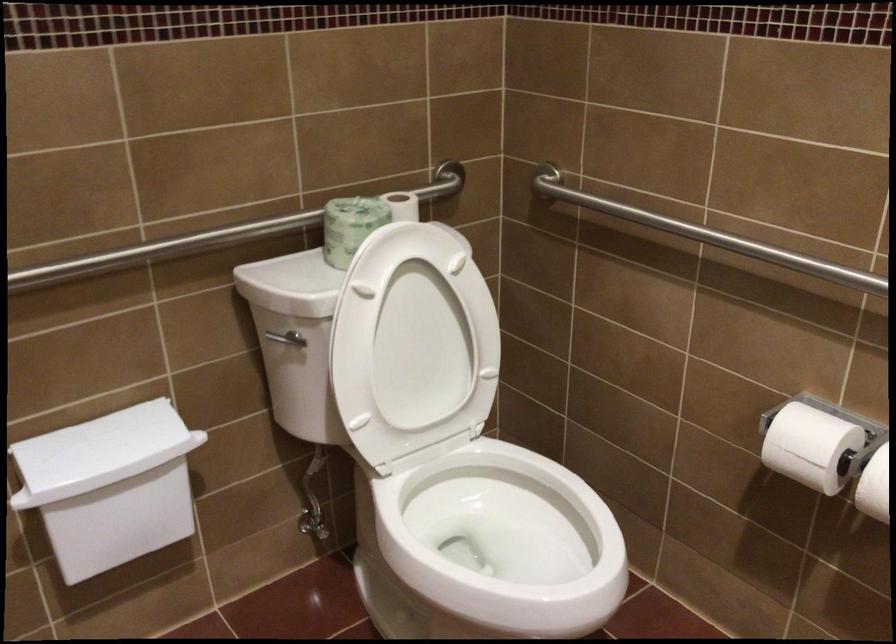
Image resolution: width=896 pixels, height=644 pixels. What do you see at coordinates (350, 225) in the screenshot?
I see `a green toilet paper roll` at bounding box center [350, 225].